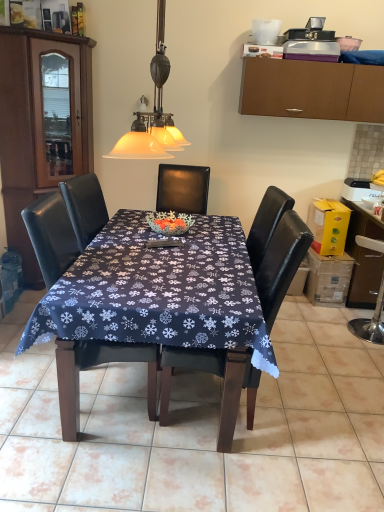
What are the coordinates of `free space to the right of black leather chair at center, which is the 1th chair from right to left` in the screenshot? It's located at (326, 411).